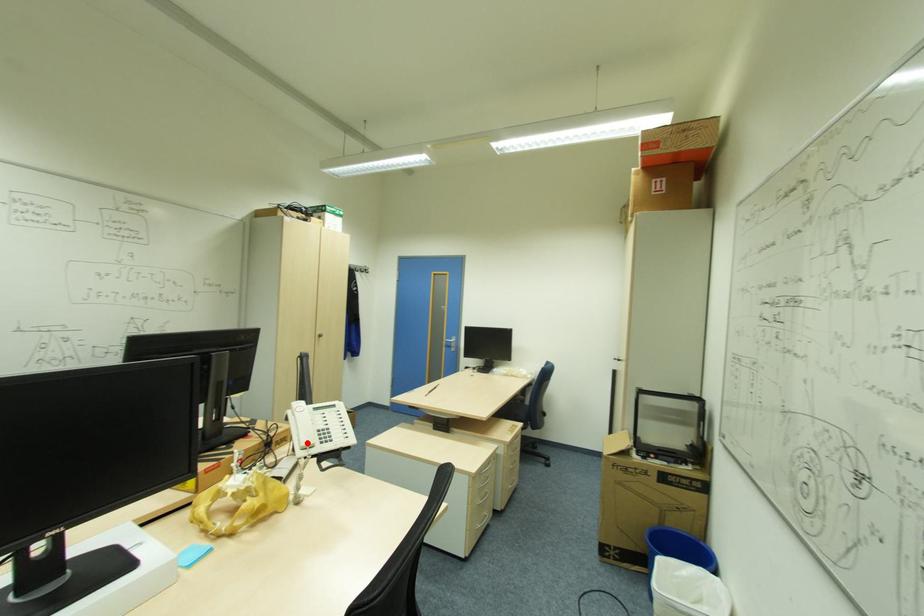
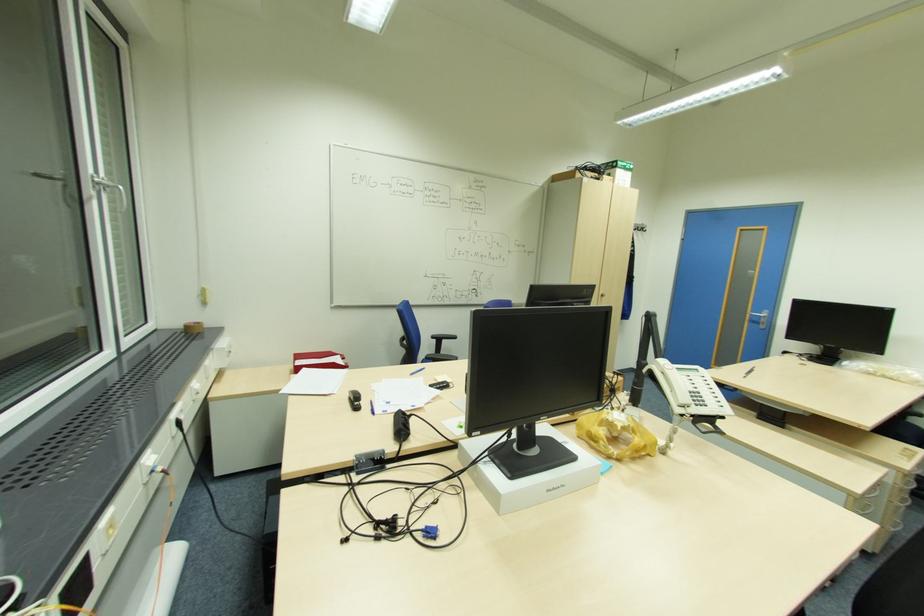
Where in the second image is the point corresponding to the highlighted location from the first image?

(685, 400)